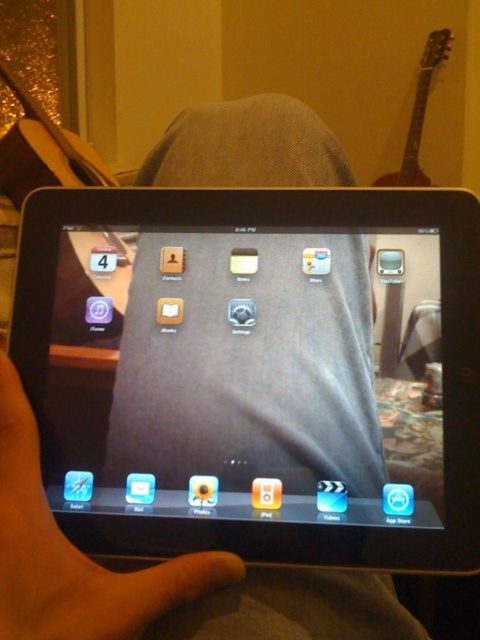
Does black glossy tablet at center have a lesser height compared to matte skin hand at center?

In fact, black glossy tablet at center may be taller than matte skin hand at center.

Is black glossy tablet at center above matte skin hand at center?

Indeed, black glossy tablet at center is positioned over matte skin hand at center.

Identify the location of black glossy tablet at center. (256, 371).